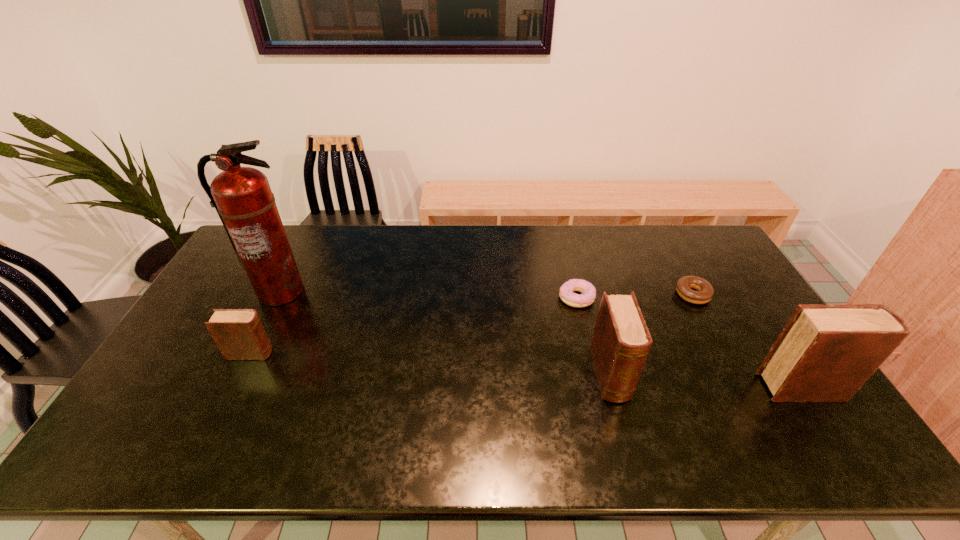
The width and height of the screenshot is (960, 540). Identify the location of vacant space at the near left corner of the desktop. (134, 411).

Locate an element on the screen. This screenshot has width=960, height=540. free region at the far right corner is located at coordinates (693, 235).

In order to click on free space that is in between the leftmost diary and the right doughnut in this screenshot , I will do `click(471, 323)`.

The width and height of the screenshot is (960, 540). Identify the location of free area in between the right doughnut and the third tallest object. (652, 335).

At what (x,y) coordinates should I click in order to perform the action: click on vacant area that lies between the fire extinguisher and the right doughnut. Please return your answer as a coordinate pair (x, y). Looking at the image, I should click on 487,293.

Identify the location of unoccupied position between the right doughnut and the rightmost diary. (748, 341).

You are a GUI agent. You are given a task and a screenshot of the screen. Output one action in this format:
    pyautogui.click(x=<x>, y=<y>)
    Task: Click on the vacant space that is in between the tallest object and the right doughnut
    The image size is (960, 540).
    Given the screenshot: What is the action you would take?
    pyautogui.click(x=487, y=293)

What are the coordinates of `empty space that is in between the right doughnut and the second diary from left to right` in the screenshot? It's located at (652, 335).

Locate an element on the screen. The width and height of the screenshot is (960, 540). blank region between the rightmost diary and the left doughnut is located at coordinates (690, 342).

The height and width of the screenshot is (540, 960). What are the coordinates of `free space between the second tallest diary and the fourth tallest object` in the screenshot? It's located at (430, 364).